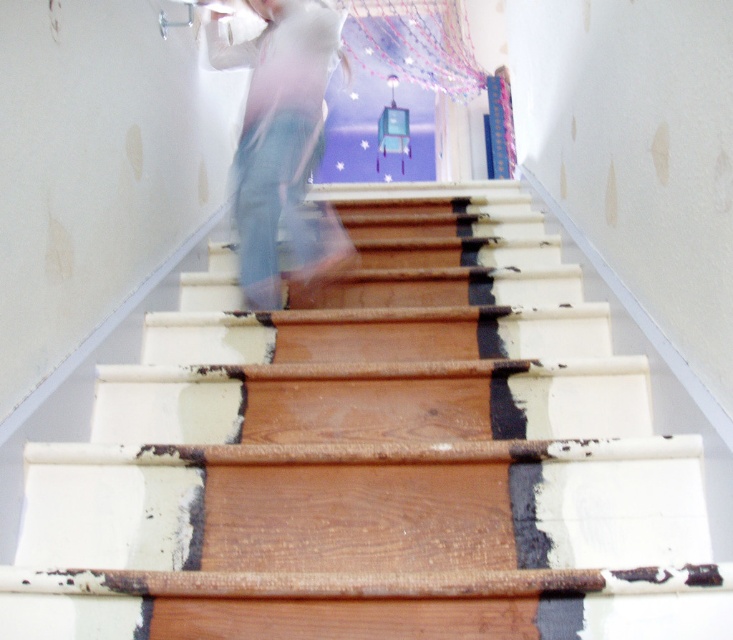
Who is higher up, wooden stairs at center or light blue jeans at center?

light blue jeans at center is higher up.

Is wooden stairs at center to the left of light blue jeans at center from the viewer's perspective?

No, wooden stairs at center is not to the left of light blue jeans at center.

Is point (633, 488) positioned after point (265, 118)?

No, (633, 488) is in front of (265, 118).

Where is `wooden stairs at center`? This screenshot has height=640, width=733. wooden stairs at center is located at coordinates (375, 456).